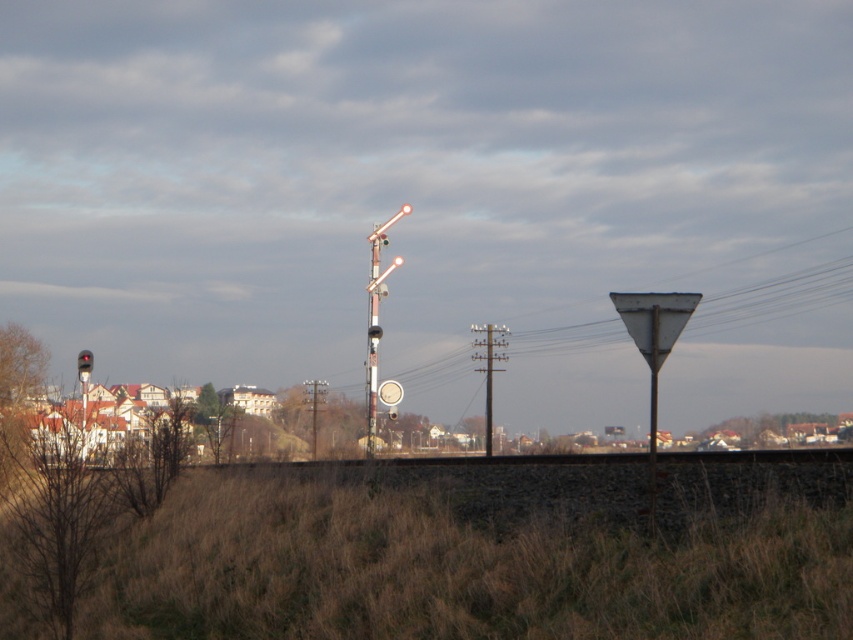
Question: In this image, where is metallic signal pole at center located relative to metallic pole at center?

Choices:
 (A) right
 (B) left

Answer: (B)

Question: Where is metallic signal pole at center located in relation to metallic pole at center in the image?

Choices:
 (A) above
 (B) below

Answer: (A)

Question: Which point is farther to the camera?

Choices:
 (A) (491, 442)
 (B) (369, 284)

Answer: (A)

Question: Which point is closer to the camera taking this photo?

Choices:
 (A) (506, 330)
 (B) (370, 394)

Answer: (B)

Question: Can you confirm if metallic signal pole at center is positioned to the right of metallic pole at center?

Choices:
 (A) no
 (B) yes

Answer: (A)

Question: Which of the following is the farthest from the observer?

Choices:
 (A) metallic pole at center
 (B) metallic signal pole at center

Answer: (A)